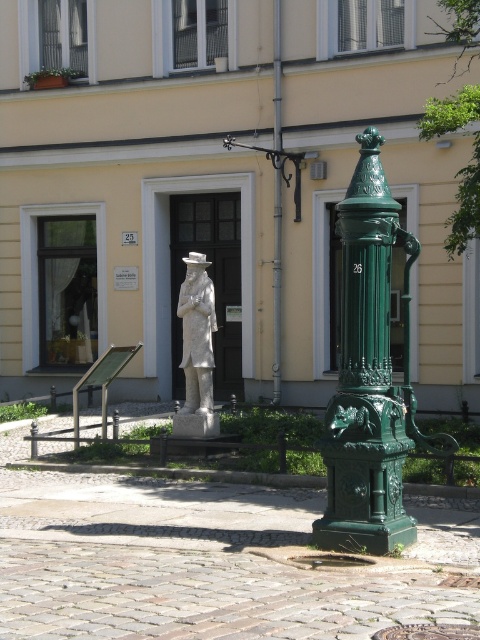
Is green metal pole at upper center wider than green cast iron lamp post at center?

In fact, green metal pole at upper center might be narrower than green cast iron lamp post at center.

Is green metal pole at upper center positioned in front of green cast iron lamp post at center?

No.

Find the location of a particular element. green metal pole at upper center is located at coordinates (276, 282).

Which is in front, point (192, 396) or point (277, 310)?

Point (192, 396)

Does point (202, 428) come farther from viewer compared to point (277, 186)?

No, (202, 428) is in front of (277, 186).

Between point (206, 419) and point (277, 252), which one is positioned behind?

The point (277, 252) is more distant.

Locate an element on the screen. white stone statue at center is located at coordinates (196, 349).

Does white stone statue at center have a smaller size compared to green metal pole at upper center?

Incorrect, white stone statue at center is not smaller in size than green metal pole at upper center.

The width and height of the screenshot is (480, 640). What do you see at coordinates (196, 349) in the screenshot? I see `white stone statue at center` at bounding box center [196, 349].

Locate an element on the screen. white stone statue at center is located at coordinates (196, 349).